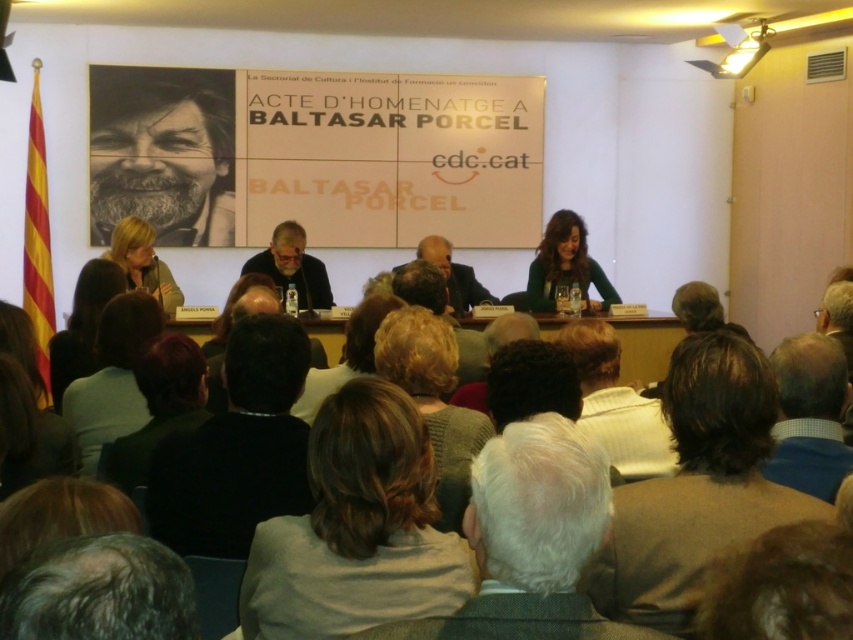
How much distance is there between matte black jacket at lower left and gray hair at center?

A distance of 1.94 meters exists between matte black jacket at lower left and gray hair at center.

Is matte black jacket at lower left thinner than gray hair at center?

No, matte black jacket at lower left is not thinner than gray hair at center.

The image size is (853, 640). I want to click on matte black jacket at lower left, so click(82, 324).

The height and width of the screenshot is (640, 853). In order to click on matte black jacket at lower left in this screenshot , I will do `click(82, 324)`.

From the picture: Who is lower down, knitted sweater at center or green matte shirt at center?

Positioned lower is knitted sweater at center.

Who is shorter, knitted sweater at center or green matte shirt at center?

Standing shorter between the two is knitted sweater at center.

Does point (418, 346) lie in front of point (563, 275)?

Yes.

The image size is (853, 640). Find the location of `knitted sweater at center`. knitted sweater at center is located at coordinates (433, 400).

Does matte black jacket at lower left appear on the left side of blonde hair at left?

Incorrect, matte black jacket at lower left is not on the left side of blonde hair at left.

Which is above, matte black jacket at lower left or blonde hair at left?

blonde hair at left is higher up.

At what (x,y) coordinates should I click in order to perform the action: click on matte black jacket at lower left. Please return your answer as a coordinate pair (x, y). Looking at the image, I should click on (82, 324).

Find the location of a particular element. This screenshot has height=640, width=853. matte black jacket at lower left is located at coordinates (82, 324).